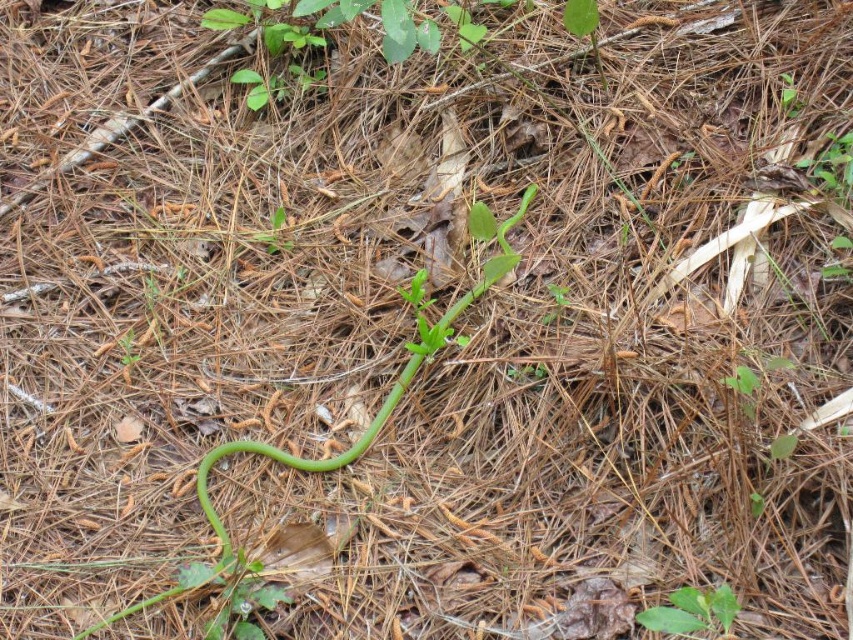
You are a nature photographer aiming to capture both the green glossy snake at center and the green matte leaf at center in a single frame. Your camera has a maximum focus range of 70 centimeters. Can you include both subjects in your shot without moving the camera?

The distance between the green glossy snake at center and the green matte leaf at center is 73.18 centimeters, which exceeds the camera maximum focus range of 70 centimeters. Therefore, you cannot include both subjects in the shot without moving the camera.

You are a hiker who spots both the green glossy snake at center and the green matte leaf at center on the forest floor. Which object is closer to you?

The green glossy snake at center is closer to you because the green matte leaf at center is behind it.

You are standing in the forest and see the green glossy snake at center. If you want to take a photo of it without moving closer than 1.5 meters, is the current distance sufficient?

The green glossy snake at center and viewer are 1.59 meters apart from each other. Since 1.59 meters is greater than 1.5 meters, the current distance is sufficient to take a photo without moving closer.